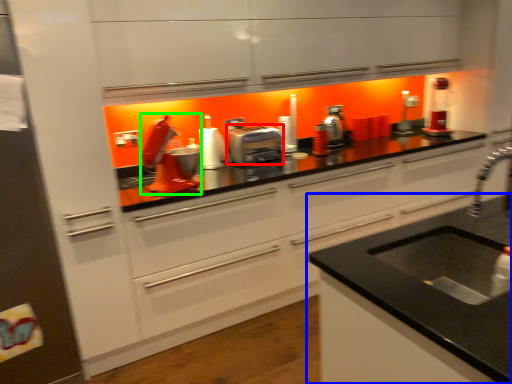
Question: Considering the real-world distances, which object is closest to kitchen appliance (highlighted by a red box)? countertop (highlighted by a blue box) or appliance (highlighted by a green box).

Choices:
 (A) countertop
 (B) appliance

Answer: (B)